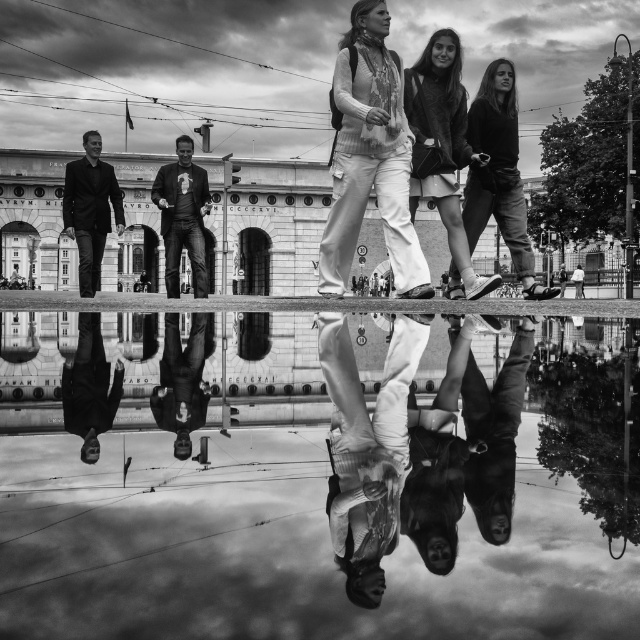
You are a photographer trying to capture the reflection of the smooth leather shoes at center and the smooth leather shoes at lower left in the puddle. Which pair of shoes will have a larger reflection in the puddle?

The smooth leather shoes at center has a larger size compared to smooth leather shoes at lower left, so their reflection in the puddle will also be larger.